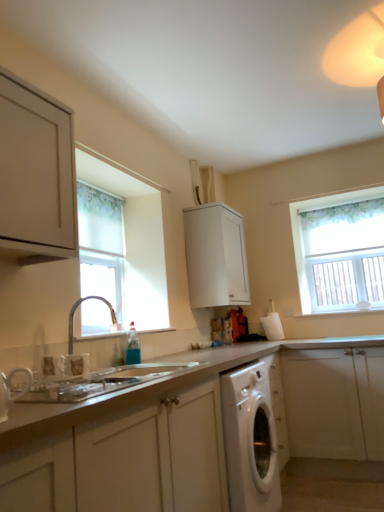
Question: Considering the relative sizes of matte white cabinet at upper left, which appears as the third cabinetry when viewed from the back, and silver metallic tap at lower left in the image provided, is matte white cabinet at upper left, which appears as the third cabinetry when viewed from the back, shorter than silver metallic tap at lower left?

Choices:
 (A) yes
 (B) no

Answer: (B)

Question: Is matte white cabinet at upper left, which appears as the third cabinetry when viewed from the back, taller than silver metallic tap at lower left?

Choices:
 (A) yes
 (B) no

Answer: (A)

Question: Can you confirm if matte white cabinet at upper left, the 2th cabinetry when ordered from front to back, is smaller than silver metallic tap at lower left?

Choices:
 (A) yes
 (B) no

Answer: (B)

Question: Could you tell me if matte white cabinet at upper left, which appears as the third cabinetry when viewed from the back, is turned towards silver metallic tap at lower left?

Choices:
 (A) no
 (B) yes

Answer: (A)

Question: Considering the relative positions of matte white cabinet at upper left, which appears as the third cabinetry when viewed from the back, and silver metallic tap at lower left in the image provided, is matte white cabinet at upper left, which appears as the third cabinetry when viewed from the back, to the right of silver metallic tap at lower left from the viewer's perspective?

Choices:
 (A) no
 (B) yes

Answer: (A)

Question: From a real-world perspective, is matte white cabinet at upper left, the 2th cabinetry when ordered from front to back, positioned under silver metallic tap at lower left based on gravity?

Choices:
 (A) yes
 (B) no

Answer: (B)

Question: Is white fabric window at left, which is counted as the second window, starting from the right, positioned with its back to white textured window at upper right, which is counted as the second window, starting from the left?

Choices:
 (A) no
 (B) yes

Answer: (A)

Question: Can you confirm if white fabric window at left, the 1th window positioned from the front, is taller than white textured window at upper right, which is counted as the second window, starting from the left?

Choices:
 (A) yes
 (B) no

Answer: (A)

Question: Is white fabric window at left, the 1th window positioned from the front, with white textured window at upper right, which is counted as the second window, starting from the left?

Choices:
 (A) yes
 (B) no

Answer: (B)

Question: Is the depth of white fabric window at left, which is the 1th window from left to right, greater than that of white textured window at upper right, the second window viewed from the front?

Choices:
 (A) yes
 (B) no

Answer: (B)

Question: Is white fabric window at left, which is the 1th window from left to right, oriented towards white textured window at upper right, the first window in the right-to-left sequence?

Choices:
 (A) yes
 (B) no

Answer: (B)

Question: Is the position of white fabric window at left, which is counted as the second window, starting from the right, less distant than that of white textured window at upper right, the 1th window from the back?

Choices:
 (A) no
 (B) yes

Answer: (B)

Question: Can you confirm if white textured window at upper right, the 1th window from the back, is thinner than white glossy washing machine at lower center?

Choices:
 (A) yes
 (B) no

Answer: (A)